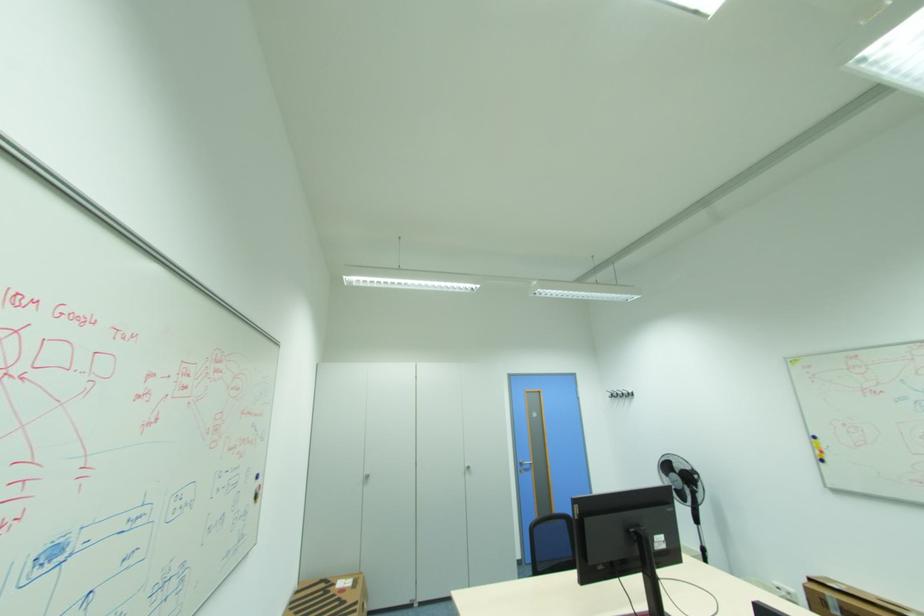
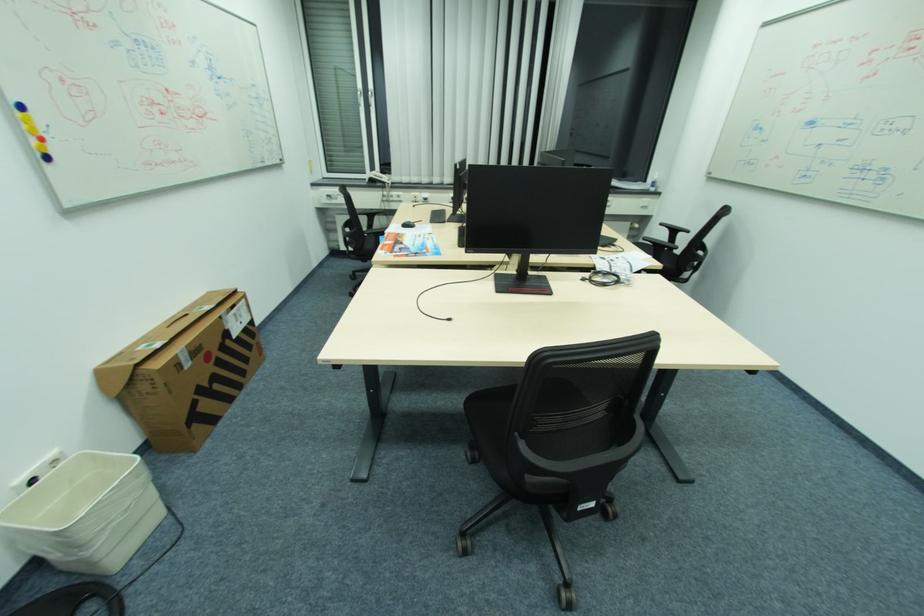
Locate, in the second image, the point that corresponds to the point at 827,461 in the first image.

(52, 158)